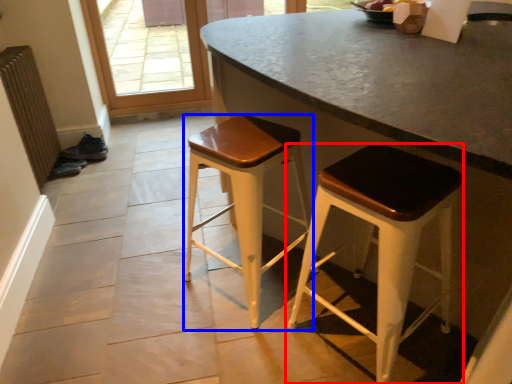
Question: Which point is further to the camera, stool (highlighted by a red box) or stool (highlighted by a blue box)?

Choices:
 (A) stool
 (B) stool

Answer: (B)